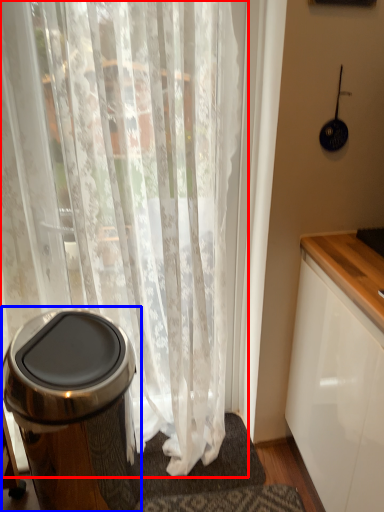
Question: Which of the following is the closest to the observer, curtain (highlighted by a red box) or waste container (highlighted by a blue box)?

Choices:
 (A) curtain
 (B) waste container

Answer: (A)